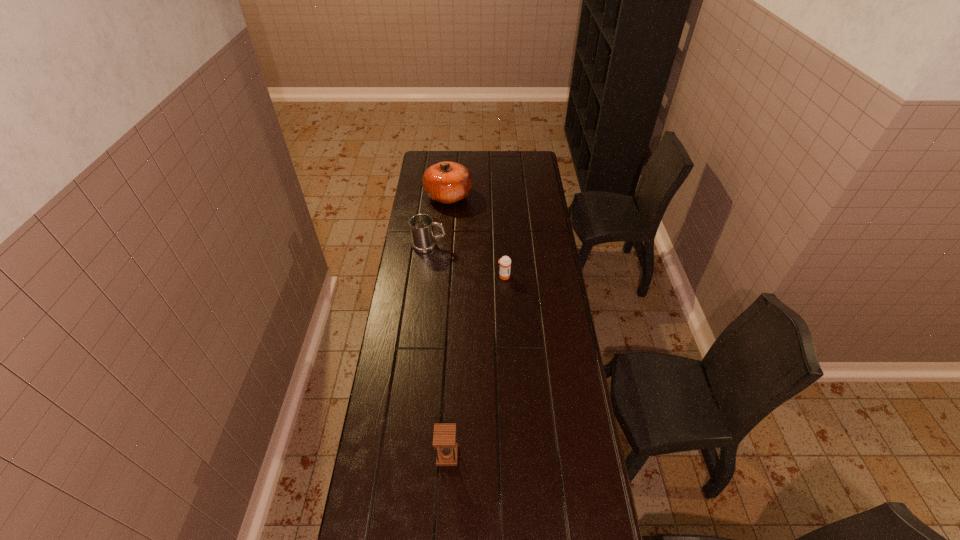
Find the location of a particular element. This screenshot has height=540, width=960. pumpkin that is at the left edge is located at coordinates (447, 182).

The width and height of the screenshot is (960, 540). What are the coordinates of `mug that is at the left edge` in the screenshot? It's located at (423, 239).

In the image, there is a desktop. Where is `free space at the left edge`? This screenshot has height=540, width=960. free space at the left edge is located at coordinates (406, 379).

You are a GUI agent. You are given a task and a screenshot of the screen. Output one action in this format:
    pyautogui.click(x=<x>, y=<y>)
    Task: Click on the free location at the right edge
    
    Given the screenshot: What is the action you would take?
    pyautogui.click(x=540, y=348)

Where is `vacant space that's between the tallest object and the hourglass`? Image resolution: width=960 pixels, height=540 pixels. vacant space that's between the tallest object and the hourglass is located at coordinates (447, 326).

At what (x,y) coordinates should I click in order to perform the action: click on vacant space in between the rightmost object and the farthest object. Please return your answer as a coordinate pair (x, y). Image resolution: width=960 pixels, height=540 pixels. Looking at the image, I should click on (476, 236).

Locate an element on the screen. The width and height of the screenshot is (960, 540). free space between the hourglass and the tallest object is located at coordinates (447, 326).

Where is `free spot between the second nearest object and the hourglass`? The height and width of the screenshot is (540, 960). free spot between the second nearest object and the hourglass is located at coordinates (475, 366).

Find the location of a particular element. Image resolution: width=960 pixels, height=540 pixels. free spot between the nearest object and the medicine is located at coordinates (475, 366).

This screenshot has width=960, height=540. I want to click on vacant region between the farthest object and the second farthest object, so click(x=439, y=221).